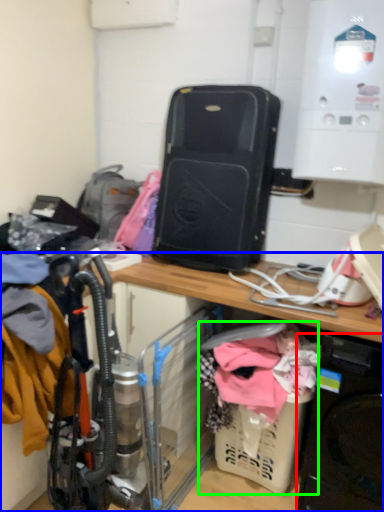
Question: Which object is the closest to the washing machine (highlighted by a red box)? Choose among these: desk (highlighted by a blue box) or baby carriage (highlighted by a green box).

Choices:
 (A) desk
 (B) baby carriage

Answer: (B)